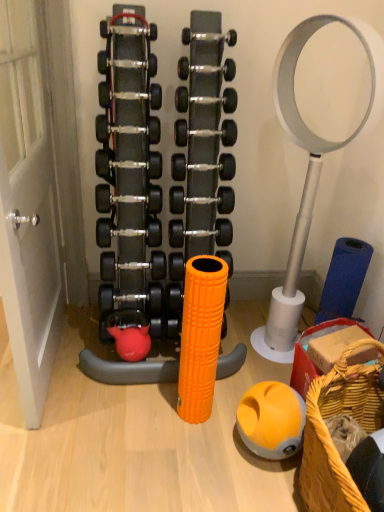
Where is `free space in front of white matte door at left`? This screenshot has height=512, width=384. free space in front of white matte door at left is located at coordinates (72, 449).